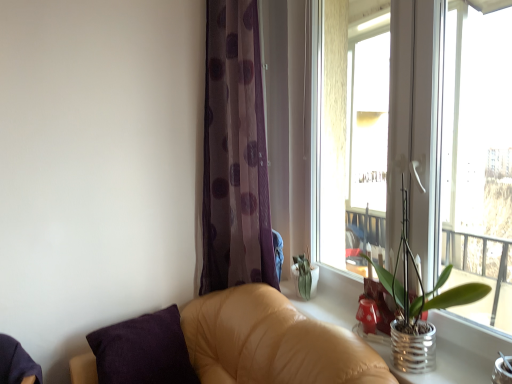
Question: Would you say tan leather couch at lower right is a long distance from transparent glass window at upper right?

Choices:
 (A) yes
 (B) no

Answer: (A)

Question: From a real-world perspective, does tan leather couch at lower right sit lower than transparent glass window at upper right?

Choices:
 (A) no
 (B) yes

Answer: (B)

Question: Considering the relative sizes of tan leather couch at lower right and transparent glass window at upper right in the image provided, is tan leather couch at lower right thinner than transparent glass window at upper right?

Choices:
 (A) yes
 (B) no

Answer: (B)

Question: Can you confirm if tan leather couch at lower right is positioned to the left of transparent glass window at upper right?

Choices:
 (A) no
 (B) yes

Answer: (B)

Question: Is tan leather couch at lower right smaller than transparent glass window at upper right?

Choices:
 (A) no
 (B) yes

Answer: (A)

Question: Can you confirm if tan leather couch at lower right is shorter than transparent glass window at upper right?

Choices:
 (A) no
 (B) yes

Answer: (B)

Question: Is silver metallic pot at right positioned behind metallic silver pot at right?

Choices:
 (A) yes
 (B) no

Answer: (A)

Question: Is metallic silver pot at right at the back of silver metallic pot at right?

Choices:
 (A) yes
 (B) no

Answer: (B)

Question: From a real-world perspective, is silver metallic pot at right over metallic silver pot at right?

Choices:
 (A) no
 (B) yes

Answer: (A)

Question: Is silver metallic pot at right shorter than metallic silver pot at right?

Choices:
 (A) yes
 (B) no

Answer: (A)

Question: Is silver metallic pot at right in contact with metallic silver pot at right?

Choices:
 (A) no
 (B) yes

Answer: (A)

Question: Does silver metallic pot at right have a lesser width compared to metallic silver pot at right?

Choices:
 (A) yes
 (B) no

Answer: (B)

Question: Can you confirm if translucent purple curtain at center is bigger than purple cotton pillow at lower left?

Choices:
 (A) yes
 (B) no

Answer: (A)